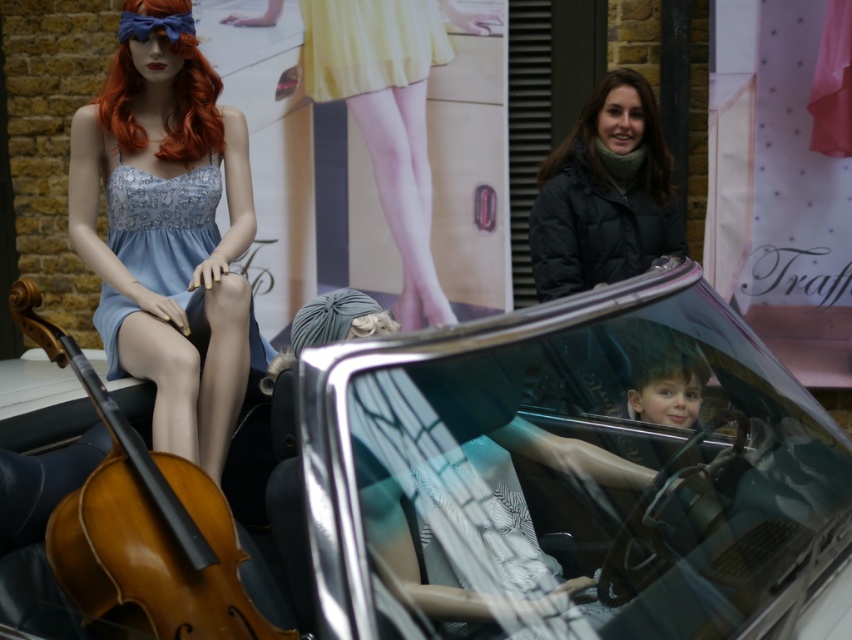
Can you confirm if shiny silver car at center is smaller than gray fabric wig at center?

Incorrect, shiny silver car at center is not smaller in size than gray fabric wig at center.

Is shiny silver car at center shorter than gray fabric wig at center?

In fact, shiny silver car at center may be taller than gray fabric wig at center.

Which is in front, point (763, 472) or point (304, 328)?

Point (763, 472) is more forward.

Identify the location of shiny silver car at center. (568, 476).

Does shiny silver car at center appear over yellow satin skirt at upper center?

Incorrect, shiny silver car at center is not positioned above yellow satin skirt at upper center.

Find the location of a particular element. shiny silver car at center is located at coordinates (568, 476).

Between matte blue dress at left and yellow satin skirt at upper center, which one is positioned lower?

Positioned lower is matte blue dress at left.

Can you confirm if matte blue dress at left is positioned below yellow satin skirt at upper center?

Correct, matte blue dress at left is located below yellow satin skirt at upper center.

The width and height of the screenshot is (852, 640). Describe the element at coordinates (168, 237) in the screenshot. I see `matte blue dress at left` at that location.

Find the location of a particular element. The height and width of the screenshot is (640, 852). matte blue dress at left is located at coordinates (168, 237).